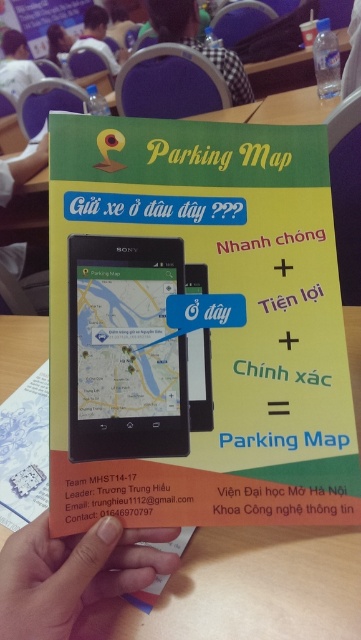
Consider the image. You are at a conference and looking at the flyer. The black checkered shirt at upper center and the matte black smartphone at center are both visible. Which object is positioned higher on the flyer?

The black checkered shirt at upper center is much taller as matte black smartphone at center, so it is positioned higher on the flyer.

You are at the event and see the flyer with the skinny orange card at lower center and the matte plastic hand at lower left. Which object is positioned lower in the image?

The skinny orange card at lower center is positioned lower than the matte plastic hand at lower left.